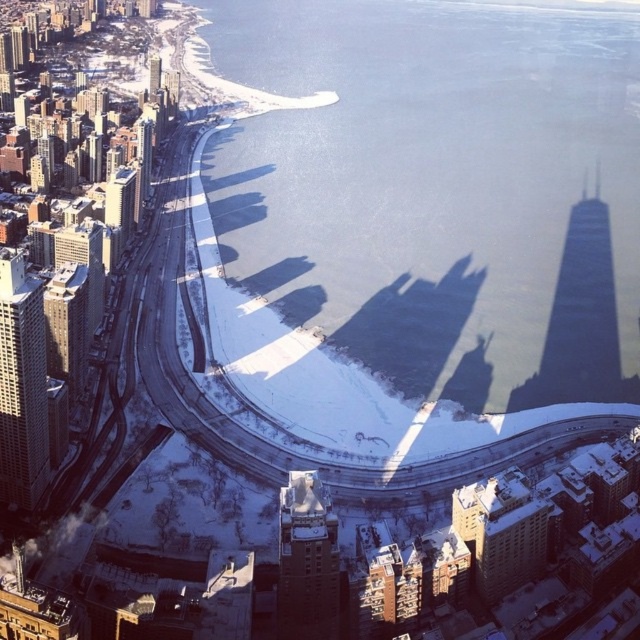
You are a city planner analyzing the cityscape. You need to determine which of the two buildings, the gray concrete skyscraper at left or the dark gray stone building at center, would cast a longer shadow at noon during winter. Based on the scene description, which building would cast a longer shadow?

The gray concrete skyscraper at left is taller than the dark gray stone building at center, so it would cast a longer shadow at noon during winter.

You are a drone operator trying to navigate between two points in the winter cityscape. The first point is point (x=412, y=269) and the second is point (x=12, y=388). Which point is closer to your current position if you are looking at the scene from above?

Point (x=412, y=269) is further to the viewer than point (x=12, y=388), so the second point is closer to your current position.